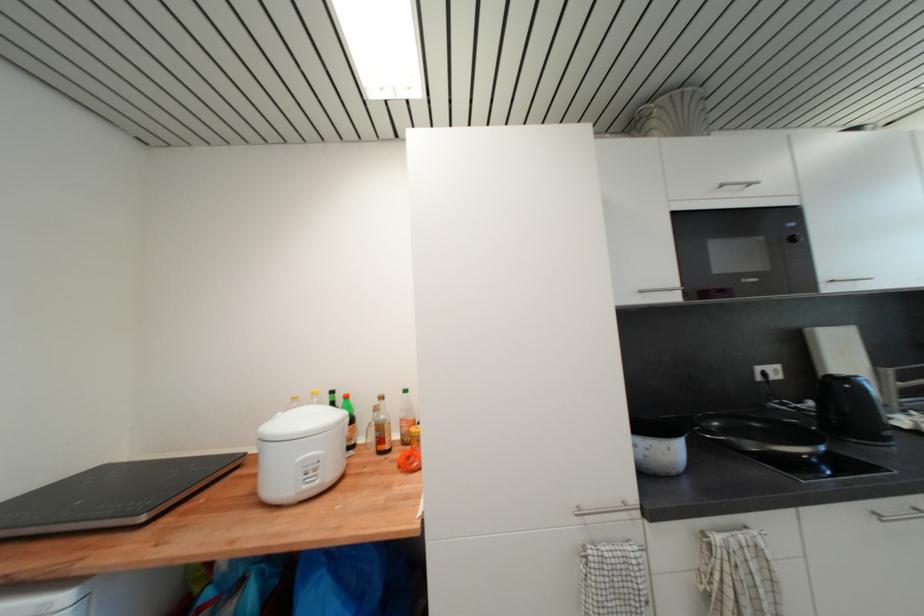
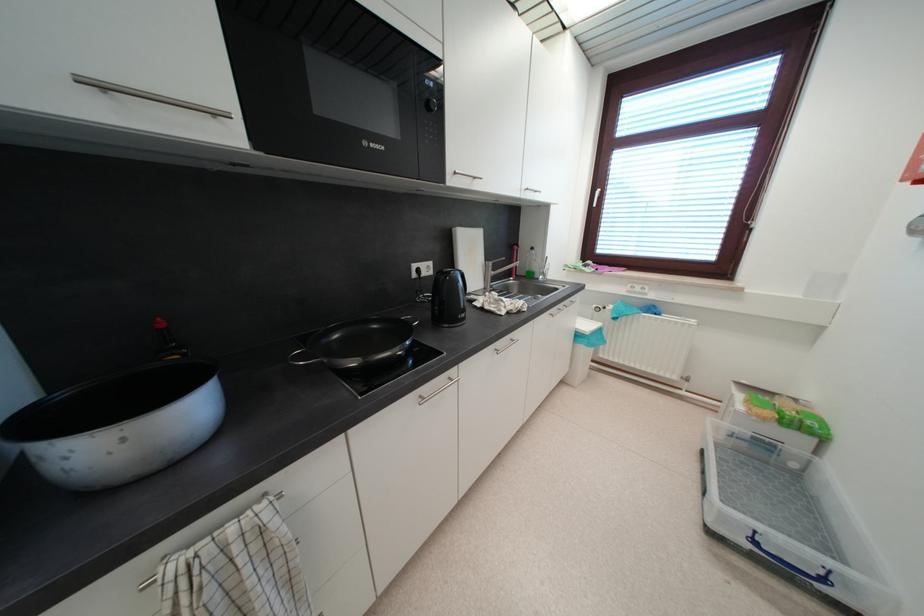
In the second image, find the point that corresponds to (652,452) in the first image.

(71, 461)